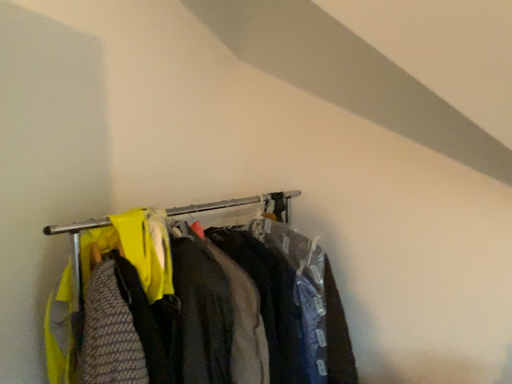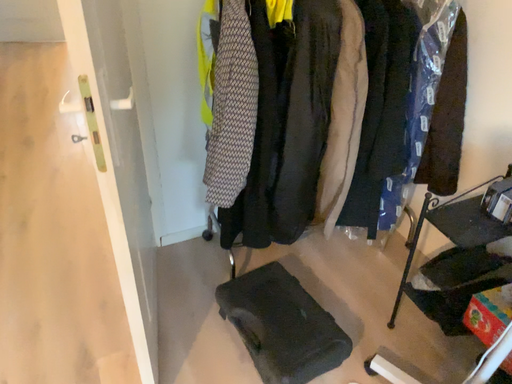
Question: How did the camera likely rotate when shooting the video?

Choices:
 (A) rotated left
 (B) rotated right

Answer: (A)